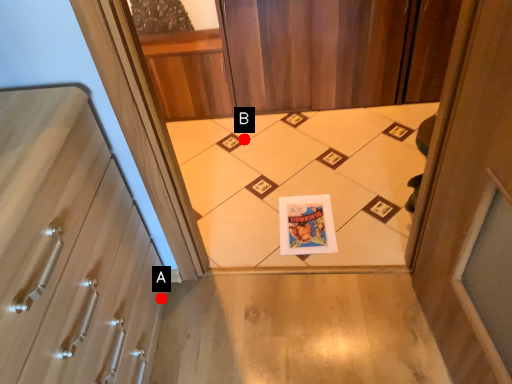
Question: Two points are circled on the image, labeled by A and B beside each circle. Among these points, which one is nearest to the camera?

Choices:
 (A) A is closer
 (B) B is closer

Answer: (A)